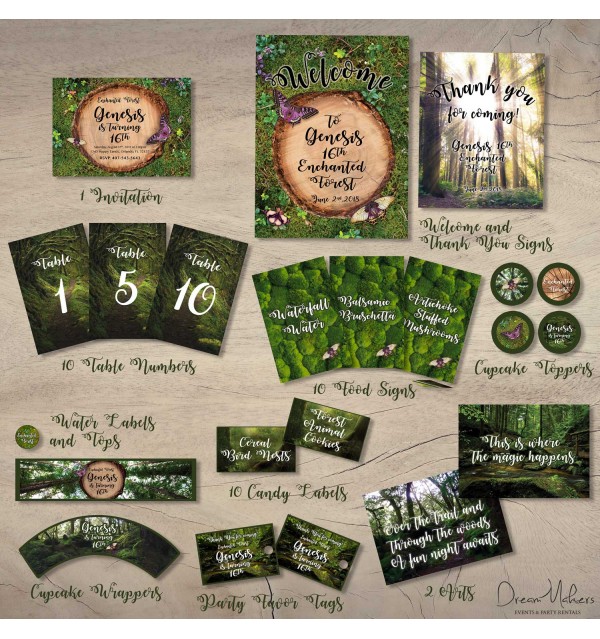
The image size is (600, 639). Find the location of `welcome and thank you signs`. welcome and thank you signs is located at coordinates (450, 225).